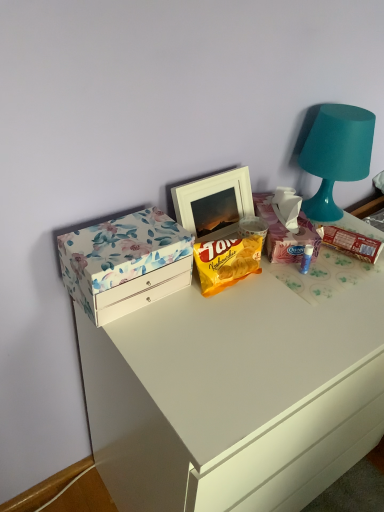
In order to click on free spot above white glossy drawer at upper left (from a real-world perspective) in this screenshot , I will do `click(278, 301)`.